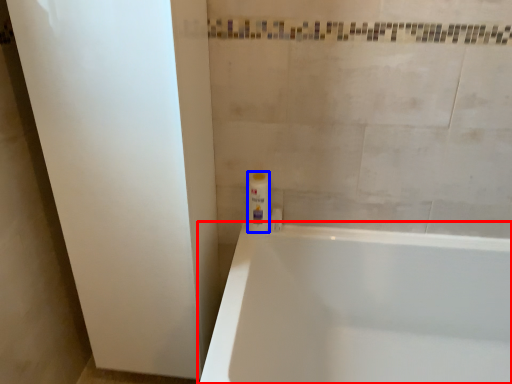
Question: Among these objects, which one is farthest to the camera, bathtub (highlighted by a red box) or toiletry (highlighted by a blue box)?

Choices:
 (A) bathtub
 (B) toiletry

Answer: (B)